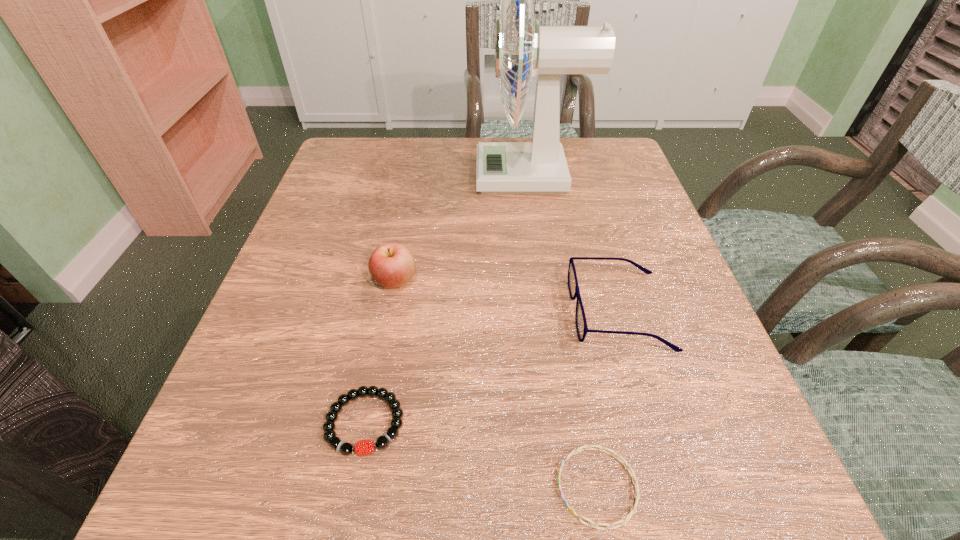
Locate an element on the screen. This screenshot has width=960, height=540. vacant region located 0.180m on the front-facing side of the farthest object is located at coordinates (403, 176).

Image resolution: width=960 pixels, height=540 pixels. Find the location of `vacant position located 0.110m on the back of the second tallest object`. vacant position located 0.110m on the back of the second tallest object is located at coordinates (405, 229).

This screenshot has width=960, height=540. I want to click on blank space located 0.080m on the front-facing side of the spectacles, so click(526, 312).

Locate an element on the screen. The width and height of the screenshot is (960, 540). vacant space located on the front-facing side of the spectacles is located at coordinates point(411,312).

This screenshot has width=960, height=540. In order to click on blank area located on the front-facing side of the spectacles in this screenshot , I will do `click(474, 312)`.

Find the location of a particular element. The width and height of the screenshot is (960, 540). free region located 0.140m on the right of the left bracelet is located at coordinates (503, 422).

You are a GUI agent. You are given a task and a screenshot of the screen. Output one action in this format:
    pyautogui.click(x=<x>, y=<y>)
    Task: Click on the free region located 0.310m on the surface of the shorter bracelet showing star-shaped elements
    This screenshot has width=960, height=540.
    Given the screenshot: What is the action you would take?
    pyautogui.click(x=314, y=487)

Identify the location of vacant area located on the surface of the shorter bracelet showing star-shaped elements. Image resolution: width=960 pixels, height=540 pixels. (259, 487).

The height and width of the screenshot is (540, 960). Find the location of `vacant region located on the surface of the shorter bracelet showing star-shaped elements`. vacant region located on the surface of the shorter bracelet showing star-shaped elements is located at coordinates (282, 487).

Image resolution: width=960 pixels, height=540 pixels. What are the coordinates of `object located in the far edge section of the desktop` in the screenshot? It's located at (538, 167).